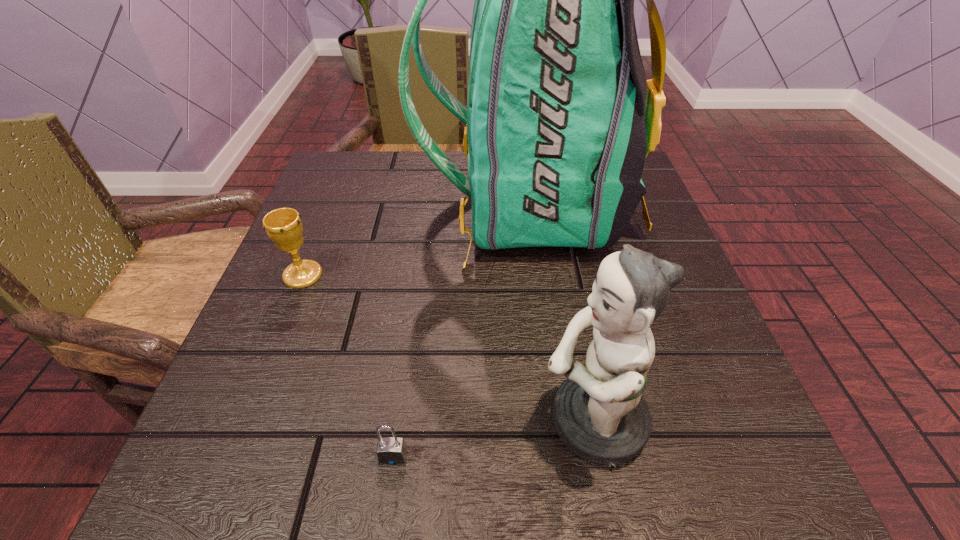
In the image, there is a desktop. Identify the location of free region at the far edge. (396, 199).

Locate an element on the screen. blank area at the left edge is located at coordinates (293, 368).

This screenshot has height=540, width=960. In order to click on free space at the right edge of the desktop in this screenshot , I will do `click(630, 245)`.

The image size is (960, 540). In order to click on vacant space that's between the shortest object and the figurine in this screenshot , I will do coord(492,438).

Where is `vacant space in between the second tallest object and the padlock`? Image resolution: width=960 pixels, height=540 pixels. vacant space in between the second tallest object and the padlock is located at coordinates (492, 438).

The height and width of the screenshot is (540, 960). I want to click on vacant region between the padlock and the backpack, so click(461, 332).

Identify the location of free point between the third tallest object and the padlock. This screenshot has width=960, height=540. (348, 366).

Identify the location of vacant space in between the chalice and the second tallest object. (447, 348).

Where is `free space that is in between the third shortest object and the second shortest object`? free space that is in between the third shortest object and the second shortest object is located at coordinates (447, 348).

Locate an element on the screen. Image resolution: width=960 pixels, height=540 pixels. free space between the third shortest object and the leftmost object is located at coordinates (447, 348).